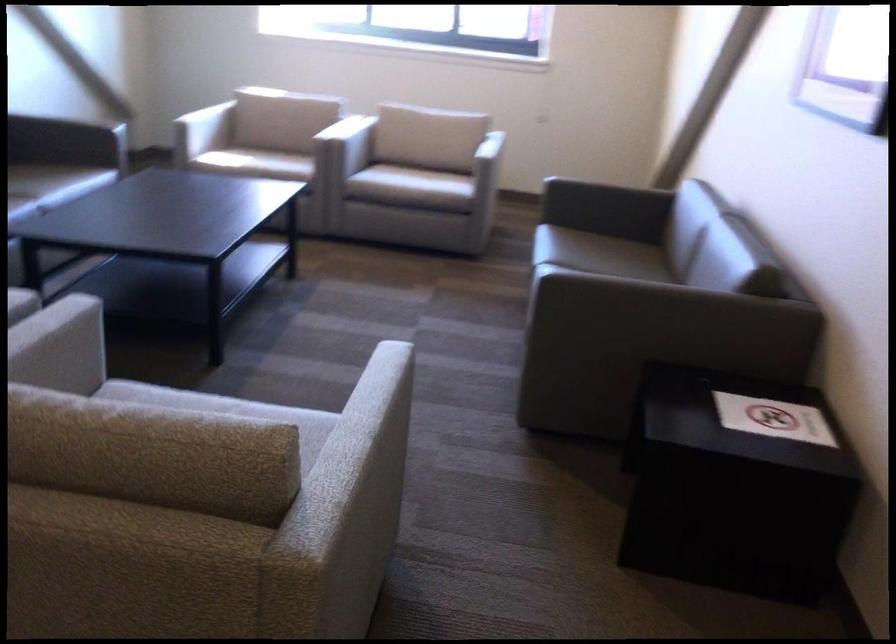
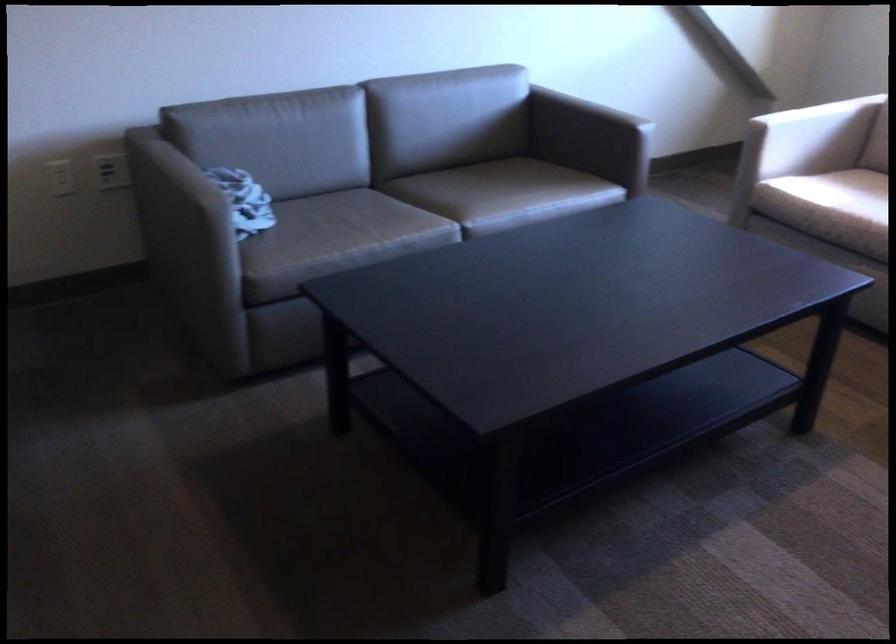
Where in the second image is the point corresponding to point 237,160 from the first image?

(821, 216)